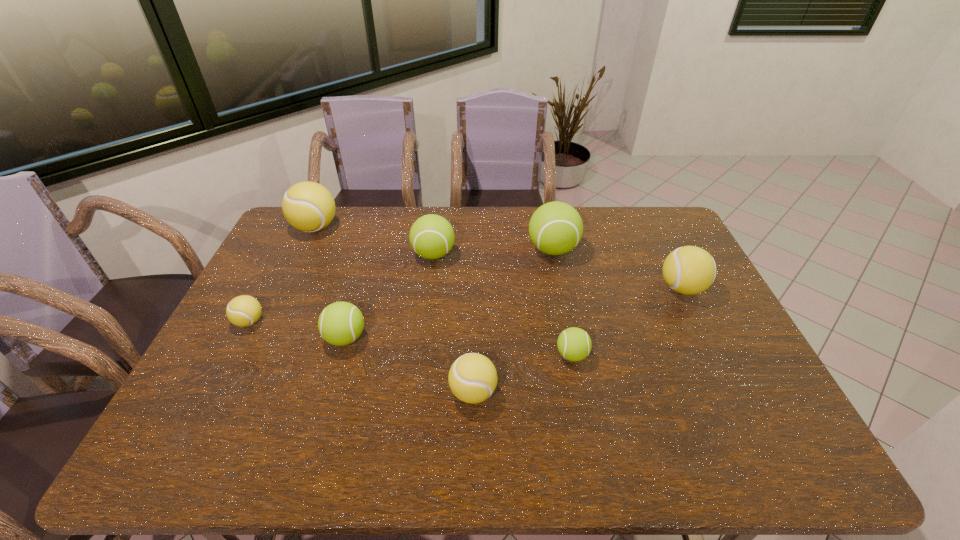
Identify the location of object present at the right edge. (689, 270).

Image resolution: width=960 pixels, height=540 pixels. In order to click on object located in the far left corner section of the desktop in this screenshot , I will do `click(308, 206)`.

At what (x,y) coordinates should I click in order to perform the action: click on blank space at the far edge of the desktop. Please return your answer as a coordinate pair (x, y). The height and width of the screenshot is (540, 960). Looking at the image, I should click on (597, 231).

In the image, there is a desktop. In order to click on vacant region at the near edge in this screenshot , I will do `click(538, 444)`.

Find the location of a particular element. free location at the left edge is located at coordinates (262, 262).

Locate an element on the screen. The height and width of the screenshot is (540, 960). free location at the far right corner of the desktop is located at coordinates (645, 237).

At what (x,y) coordinates should I click in order to perform the action: click on vacant space in between the smallest green tennis ball and the fourth object from left to right. Please return your answer as a coordinate pair (x, y). The width and height of the screenshot is (960, 540). Looking at the image, I should click on (503, 305).

You are a GUI agent. You are given a task and a screenshot of the screen. Output one action in this format:
    pyautogui.click(x=<x>, y=<y>)
    Task: Click on the free point between the biggest green tennis ball and the fifth object from left to right
    The width and height of the screenshot is (960, 540).
    Given the screenshot: What is the action you would take?
    (x=513, y=321)

Find the location of a particular element. The height and width of the screenshot is (540, 960). free space between the smallest green tennis ball and the rightmost yellow tennis ball is located at coordinates (627, 322).

The width and height of the screenshot is (960, 540). I want to click on free space between the biggest green tennis ball and the nearest yellow tennis ball, so click(x=513, y=321).